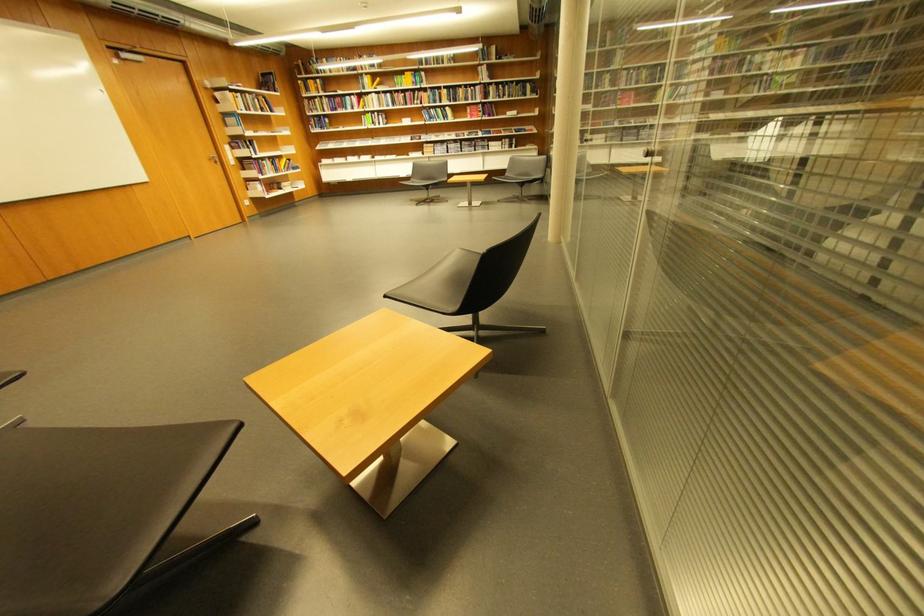
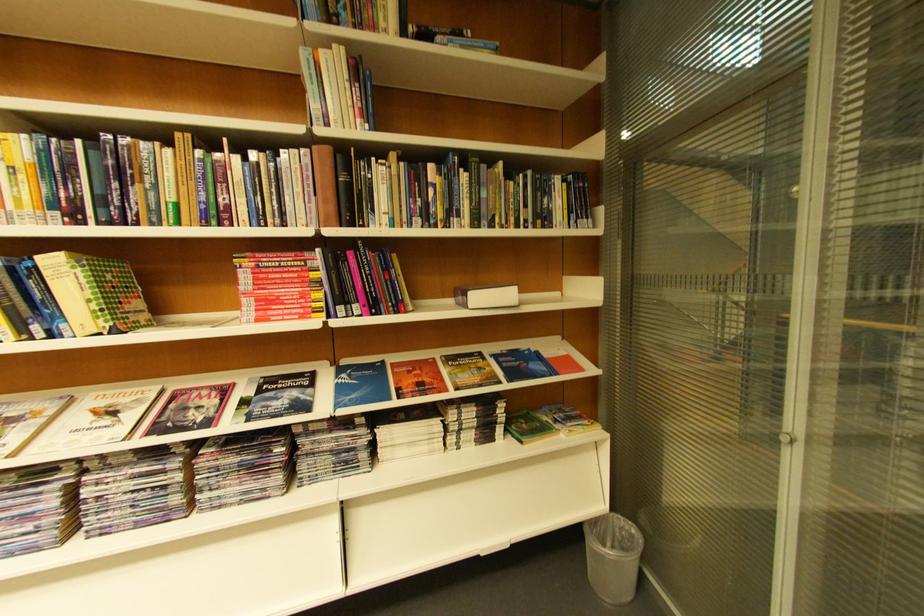
The point at (457, 110) is marked in the first image. Where is the corresponding point in the second image?

(63, 264)